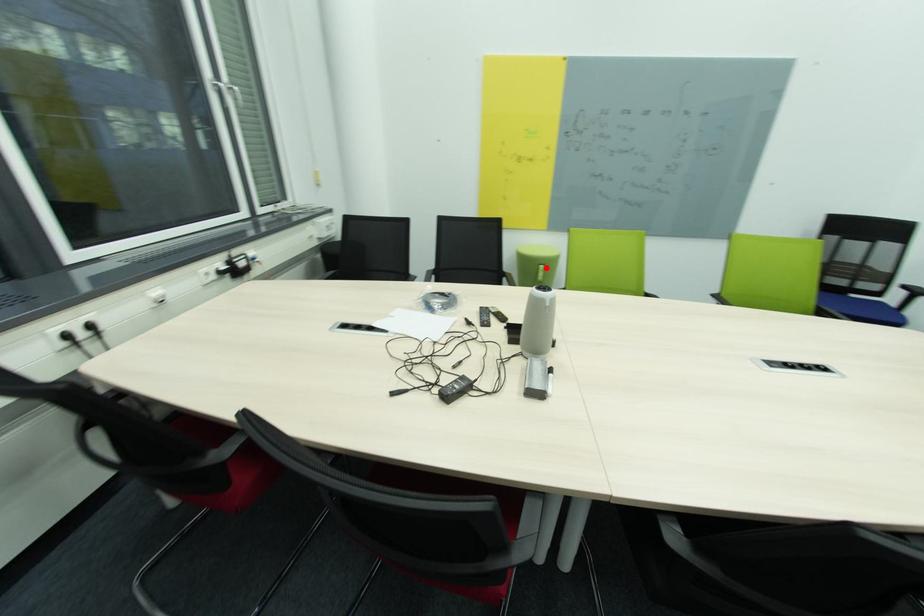
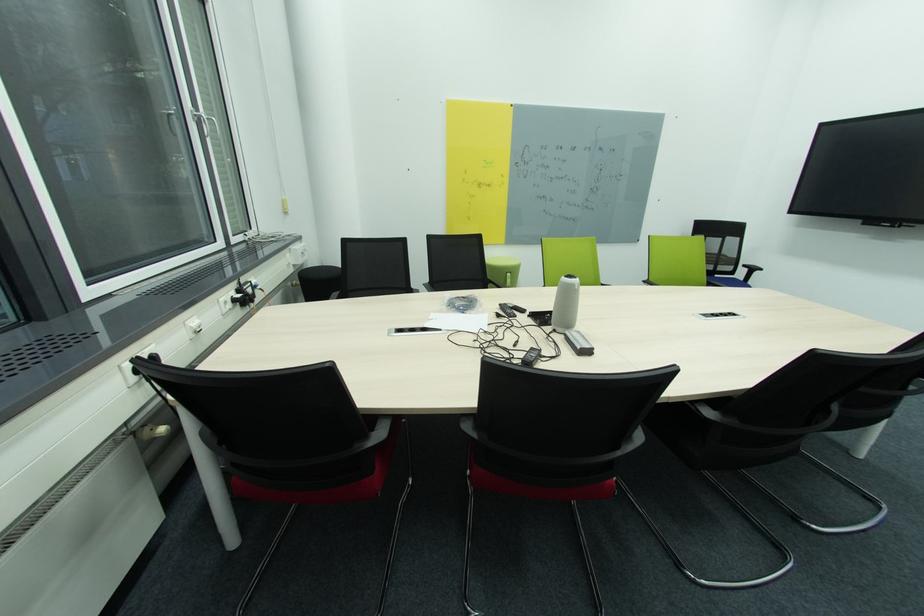
Locate, in the second image, the point that corresponds to the highlighted location in the first image.

(514, 276)